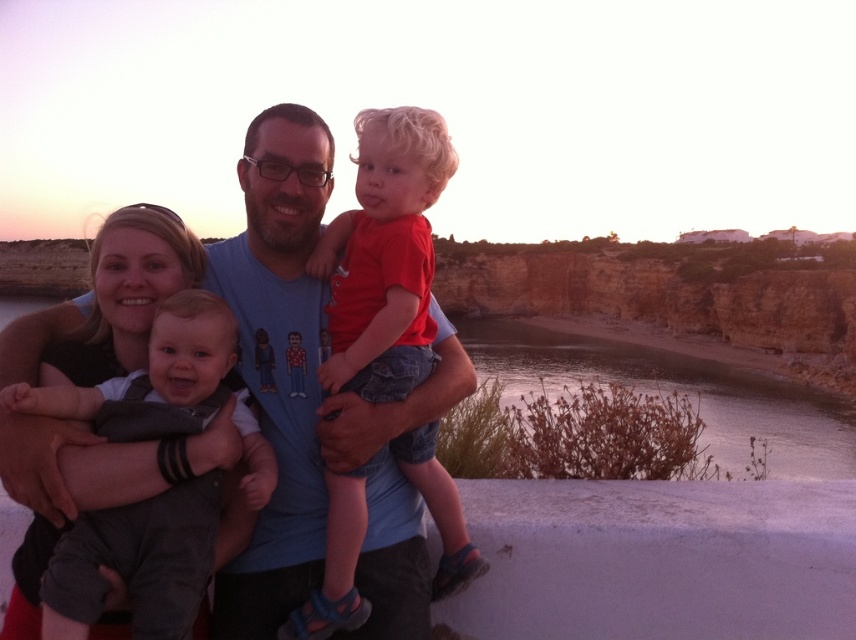
You are a photographer standing at the center of the scene. You want to take a photo that includes both the point at (16, 445) and the point at (426, 276). Which point should you focus on first to ensure both are in focus?

You should focus on the point at (426, 276) first because it is farther away from you than the point at (16, 445), ensuring both will be in focus when focusing on the farther point.